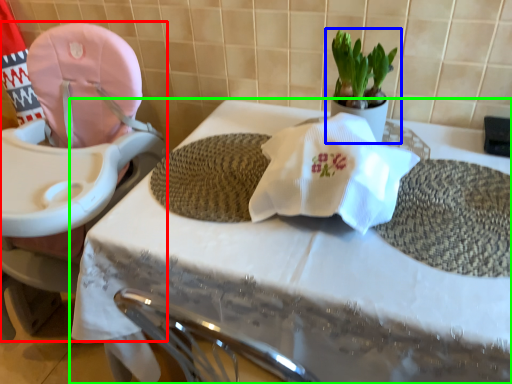
Question: Considering the real-world distances, which object is farthest from baby carriage (highlighted by a red box)? houseplant (highlighted by a blue box) or table (highlighted by a green box)?

Choices:
 (A) houseplant
 (B) table

Answer: (A)